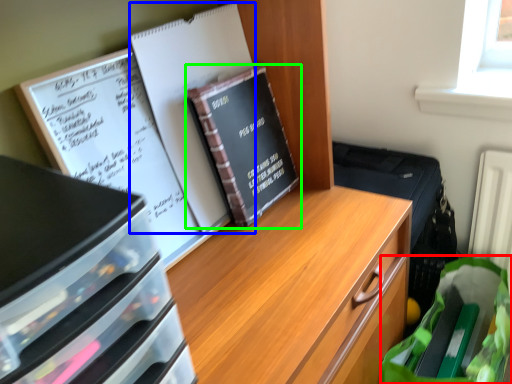
Question: Estimate the real-world distances between objects in this image. Which object is farther from grocery bag (highlighted by a red box), journal (highlighted by a blue box) or book (highlighted by a green box)?

Choices:
 (A) journal
 (B) book

Answer: (A)